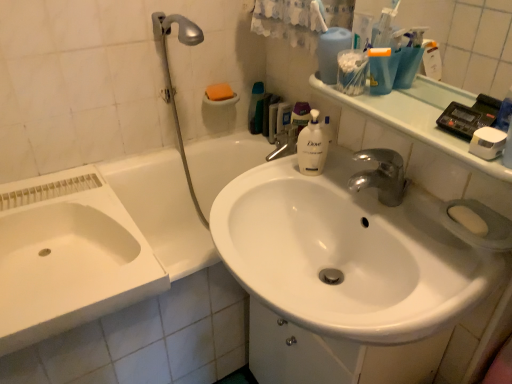
Where is `unoccupied area in front of white matte liquid soap at center, which is the 2th cleaning product from top to bottom`? The width and height of the screenshot is (512, 384). unoccupied area in front of white matte liquid soap at center, which is the 2th cleaning product from top to bottom is located at coordinates (338, 194).